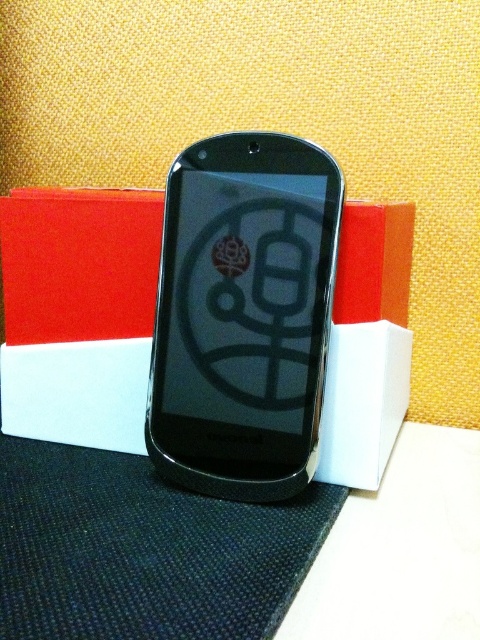
You are examining the smartphone and its packaging. There are two points on the box labeled as point (290,166) and point (325,440). Which point is nearer to you?

Point (290,166) is closer to the viewer than point (325,440).

You are looking at the image of a smartphone and its packaging. The smartphone is placed at the center. If you were to draw a vertical line exactly through the center of the image, would the black glossy smartphone at center be to the left or right of this line?

The black glossy smartphone at center is located at point 0.492 on the x and 0.508 on the y, so it is slightly to the left of the vertical center line.